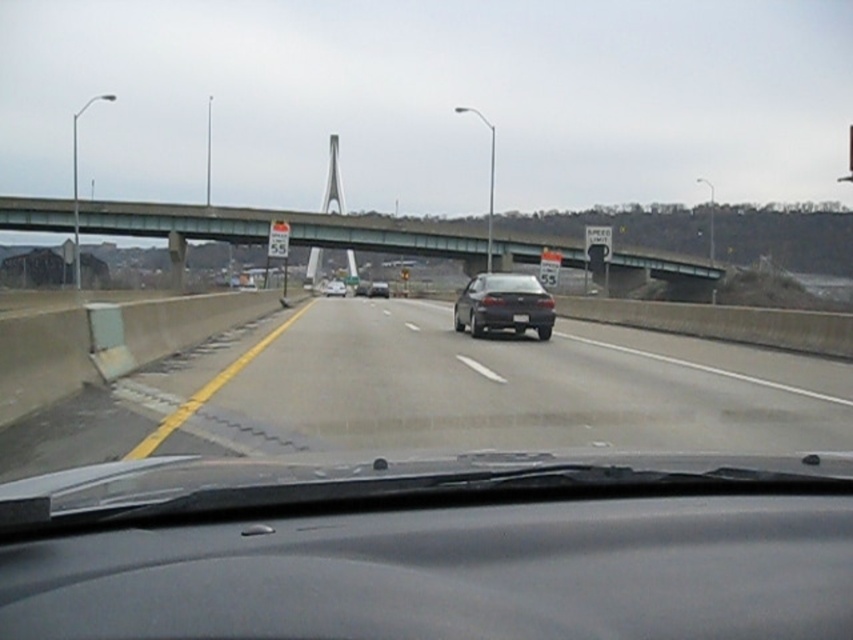
You are a passenger in a car and looking out the window. You see a concrete barrier at lower left and a shiny silver sedan at center. Which object is closer to the right side of the windshield?

The concrete barrier at lower left is to the right of the shiny silver sedan at center, so the concrete barrier at lower left is closer to the right side of the windshield.

Looking at this image, you are a driver in a car and you see the point marked at coordinates (289,227). What object is located at that point?

The point at coordinates (289,227) indicates the green concrete bridge at upper center.

You are a passenger in the car and want to know which of the two points, point (51, 220) or point (335, 285), is closer to you. Based on the scene, can you determine which point is nearer?

Point (51, 220) is closer to the viewer than point (335, 285).